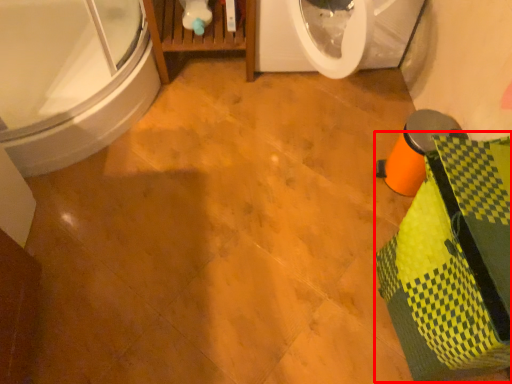
Question: Considering the relative positions of material (annotated by the red box) and bathtub in the image provided, where is material (annotated by the red box) located with respect to the staircase?

Choices:
 (A) left
 (B) right

Answer: (B)